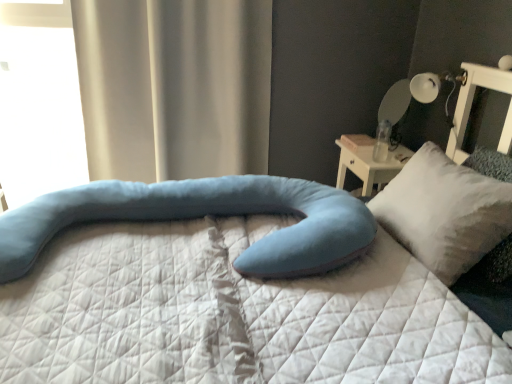
Question: Considering the relative sizes of soft blue fabric pillow at center, marked as the 1th pillow in a left-to-right arrangement, and white soft pillow at right, arranged as the second pillow when viewed from the left, in the image provided, is soft blue fabric pillow at center, marked as the 1th pillow in a left-to-right arrangement, taller than white soft pillow at right, arranged as the second pillow when viewed from the left,?

Choices:
 (A) no
 (B) yes

Answer: (A)

Question: Is soft blue fabric pillow at center, placed as the 2th pillow when sorted from right to left, turned away from white soft pillow at right, arranged as the second pillow when viewed from the left?

Choices:
 (A) yes
 (B) no

Answer: (A)

Question: Would you consider soft blue fabric pillow at center, placed as the 2th pillow when sorted from right to left, to be distant from white soft pillow at right, arranged as the second pillow when viewed from the left?

Choices:
 (A) yes
 (B) no

Answer: (B)

Question: Considering the relative sizes of soft blue fabric pillow at center, marked as the 1th pillow in a left-to-right arrangement, and white soft pillow at right, which ranks as the 1th pillow in right-to-left order, in the image provided, is soft blue fabric pillow at center, marked as the 1th pillow in a left-to-right arrangement, shorter than white soft pillow at right, which ranks as the 1th pillow in right-to-left order,?

Choices:
 (A) no
 (B) yes

Answer: (B)

Question: Considering the relative sizes of soft blue fabric pillow at center, marked as the 1th pillow in a left-to-right arrangement, and white soft pillow at right, arranged as the second pillow when viewed from the left, in the image provided, is soft blue fabric pillow at center, marked as the 1th pillow in a left-to-right arrangement, thinner than white soft pillow at right, arranged as the second pillow when viewed from the left,?

Choices:
 (A) yes
 (B) no

Answer: (B)

Question: Considering the relative positions of soft blue fabric pillow at center, placed as the 2th pillow when sorted from right to left, and white soft pillow at right, which ranks as the 1th pillow in right-to-left order, in the image provided, is soft blue fabric pillow at center, placed as the 2th pillow when sorted from right to left, behind white soft pillow at right, which ranks as the 1th pillow in right-to-left order,?

Choices:
 (A) yes
 (B) no

Answer: (B)

Question: From a real-world perspective, is transparent glass window at upper left physically above satin beige curtain at upper left?

Choices:
 (A) yes
 (B) no

Answer: (B)

Question: Is transparent glass window at upper left touching satin beige curtain at upper left?

Choices:
 (A) yes
 (B) no

Answer: (B)

Question: Is transparent glass window at upper left far from satin beige curtain at upper left?

Choices:
 (A) no
 (B) yes

Answer: (B)

Question: Is transparent glass window at upper left to the right of satin beige curtain at upper left from the viewer's perspective?

Choices:
 (A) yes
 (B) no

Answer: (B)

Question: Is transparent glass window at upper left thinner than satin beige curtain at upper left?

Choices:
 (A) no
 (B) yes

Answer: (B)

Question: Is transparent glass window at upper left not inside satin beige curtain at upper left?

Choices:
 (A) no
 (B) yes

Answer: (B)

Question: From the image's perspective, is soft blue fabric pillow at center, placed as the 2th pillow when sorted from right to left, on white glossy table lamp at upper right?

Choices:
 (A) no
 (B) yes

Answer: (A)